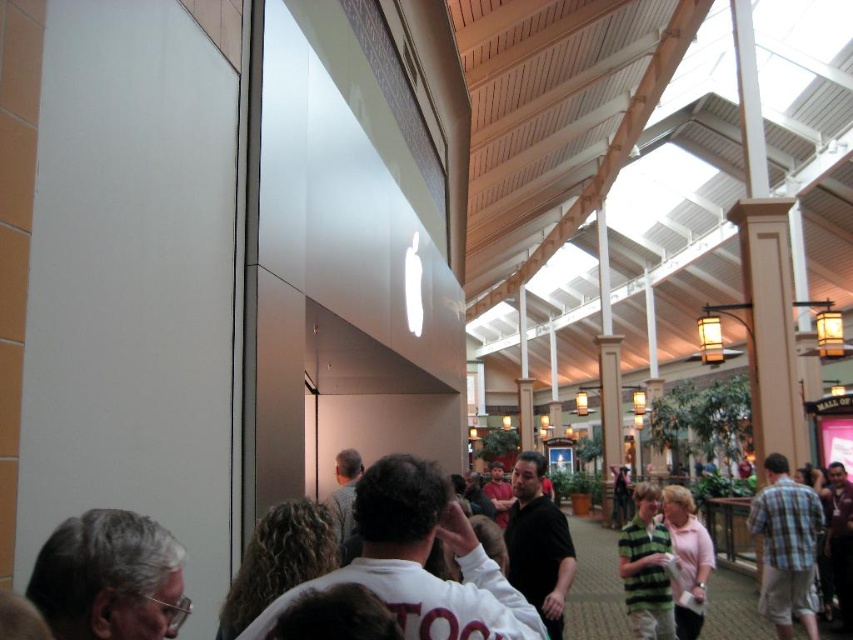
Is point (793, 557) positioned after point (648, 524)?

Yes, point (793, 557) is farther from viewer.

This screenshot has width=853, height=640. Describe the element at coordinates (786, 547) in the screenshot. I see `plaid cotton shirt at center` at that location.

Which is behind, point (814, 522) or point (645, 573)?

The point (814, 522) is more distant.

You are a GUI agent. You are given a task and a screenshot of the screen. Output one action in this format:
    pyautogui.click(x=<x>, y=<y>)
    Task: Click on the plaid cotton shirt at center
    
    Given the screenshot: What is the action you would take?
    pyautogui.click(x=786, y=547)

Looking at this image, is gray hair at lower left smaller than plaid cotton shirt at center?

Correct, gray hair at lower left occupies less space than plaid cotton shirt at center.

Does gray hair at lower left have a greater height compared to plaid cotton shirt at center?

Incorrect, gray hair at lower left's height is not larger of plaid cotton shirt at center's.

The height and width of the screenshot is (640, 853). What do you see at coordinates (109, 579) in the screenshot?
I see `gray hair at lower left` at bounding box center [109, 579].

The height and width of the screenshot is (640, 853). I want to click on gray hair at lower left, so click(109, 579).

Between gray hair at lower left and pink fabric shirt at center, which one has less height?

With less height is gray hair at lower left.

Is gray hair at lower left to the right of pink fabric shirt at center from the viewer's perspective?

No, gray hair at lower left is not to the right of pink fabric shirt at center.

This screenshot has height=640, width=853. Find the location of `gray hair at lower left`. gray hair at lower left is located at coordinates (109, 579).